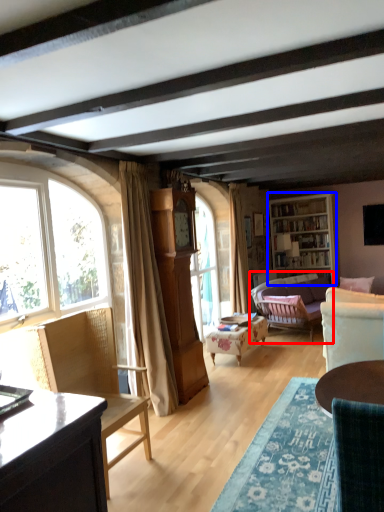
Question: Which object is further to the camera taking this photo, studio couch (highlighted by a red box) or cabinetry (highlighted by a blue box)?

Choices:
 (A) studio couch
 (B) cabinetry

Answer: (B)